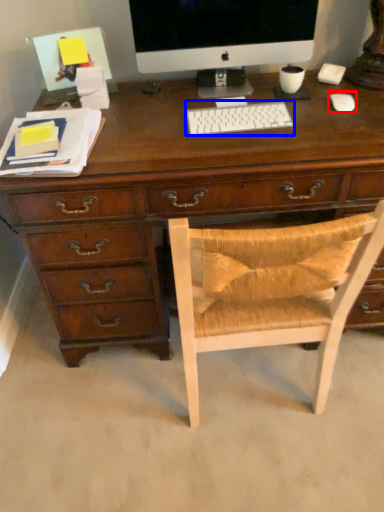
Question: Which of the following is the closest to the observer, mouse (highlighted by a red box) or computer keyboard (highlighted by a blue box)?

Choices:
 (A) mouse
 (B) computer keyboard

Answer: (B)